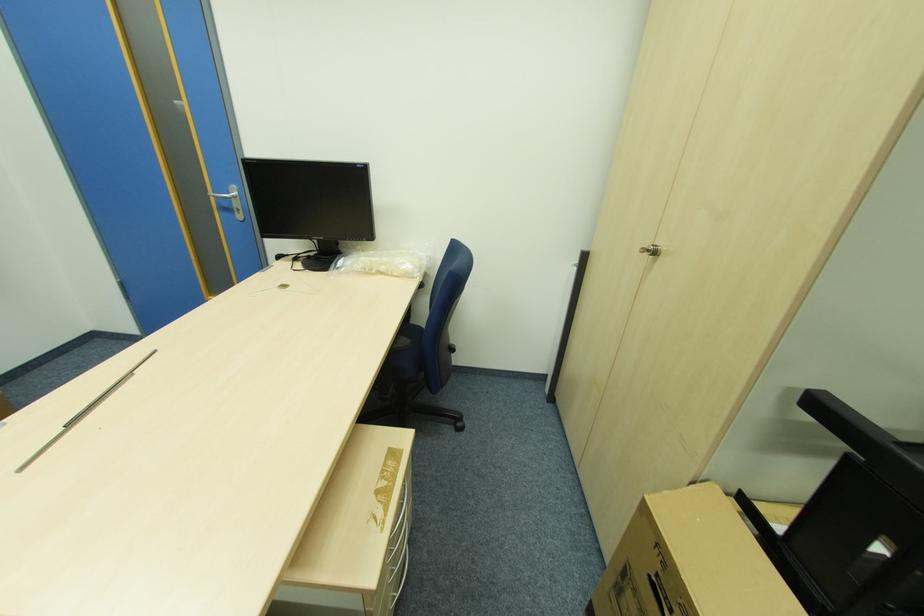
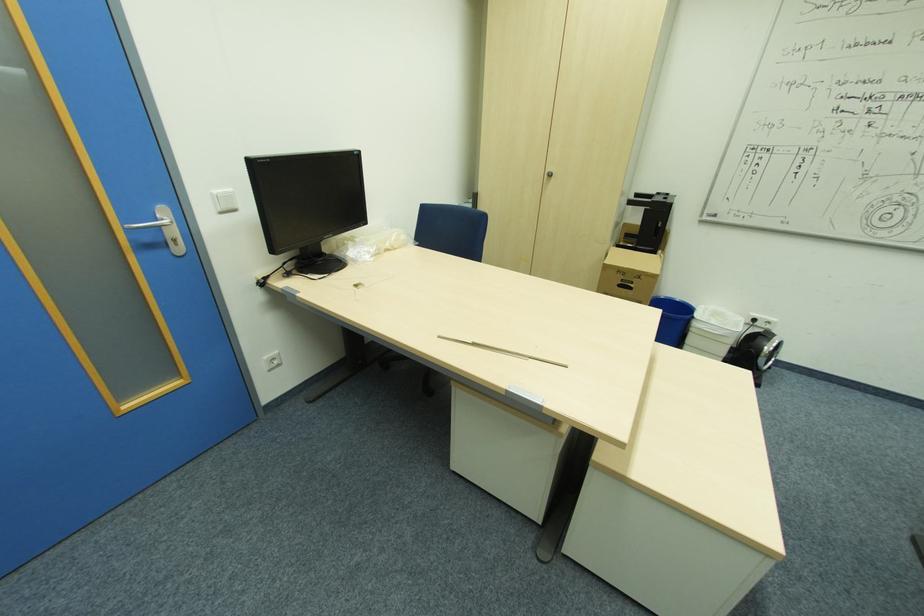
Where in the second image is the point corresponding to pixel 658 253 from the first image?

(553, 175)